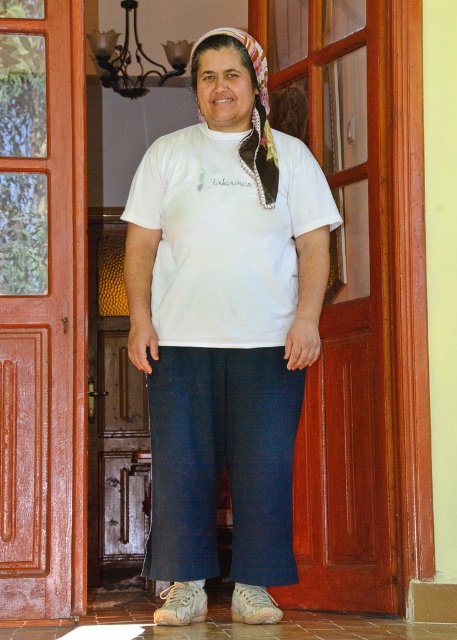
Question: Does white cotton shirt at center have a greater width compared to brown wooden door at center?

Choices:
 (A) no
 (B) yes

Answer: (B)

Question: Which object is positioned farthest from the white cotton shirt at center?

Choices:
 (A) printed silk headscarf at center
 (B) white cotton t-shirt at center
 (C) brown wooden door at center

Answer: (C)

Question: Is white cotton shirt at center behind white cotton t-shirt at center?

Choices:
 (A) yes
 (B) no

Answer: (B)

Question: Is the position of brown wooden door at center more distant than that of white cotton t-shirt at center?

Choices:
 (A) yes
 (B) no

Answer: (A)

Question: Which point is closer to the camera taking this photo?

Choices:
 (A) (79, 168)
 (B) (272, 157)
 (C) (228, 321)

Answer: (C)

Question: Estimate the real-world distances between objects in this image. Which object is closer to the white cotton t-shirt at center?

Choices:
 (A) printed silk headscarf at center
 (B) brown wooden door at center
 (C) white cotton shirt at center

Answer: (C)